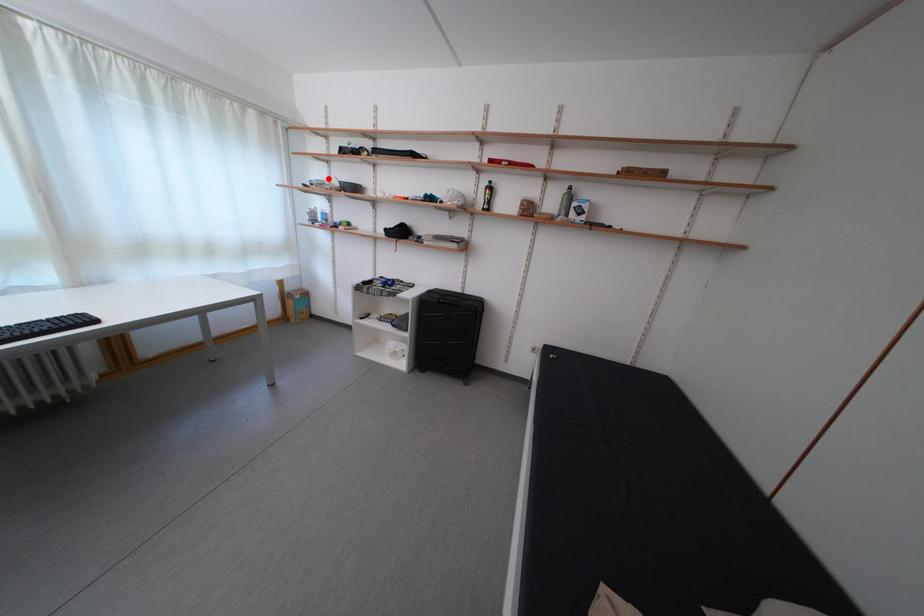
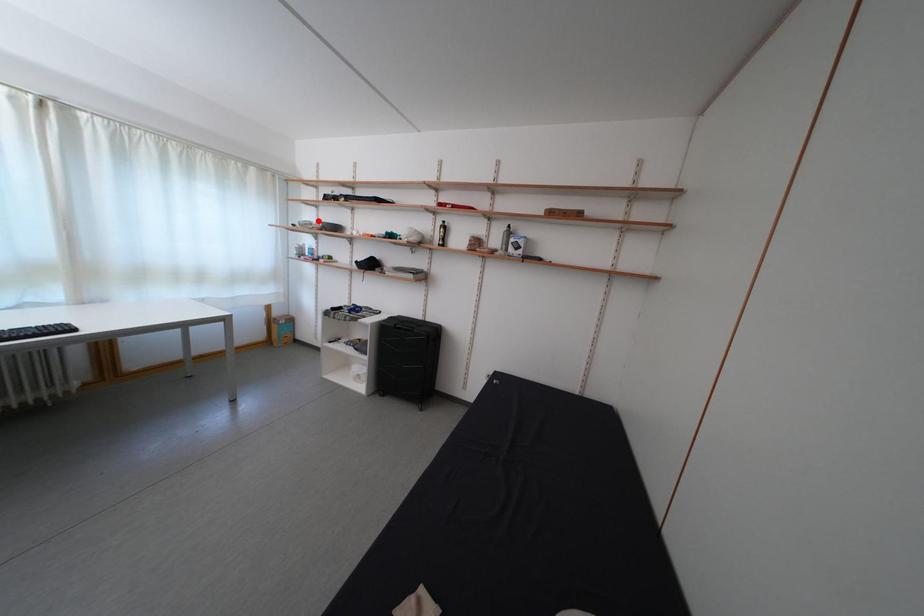
I am providing you with two images of the same scene from different viewpoints. A red point is marked on the first image and another point is marked on the second image. Does the point marked in image1 correspond to the same location as the one in image2?

Yes